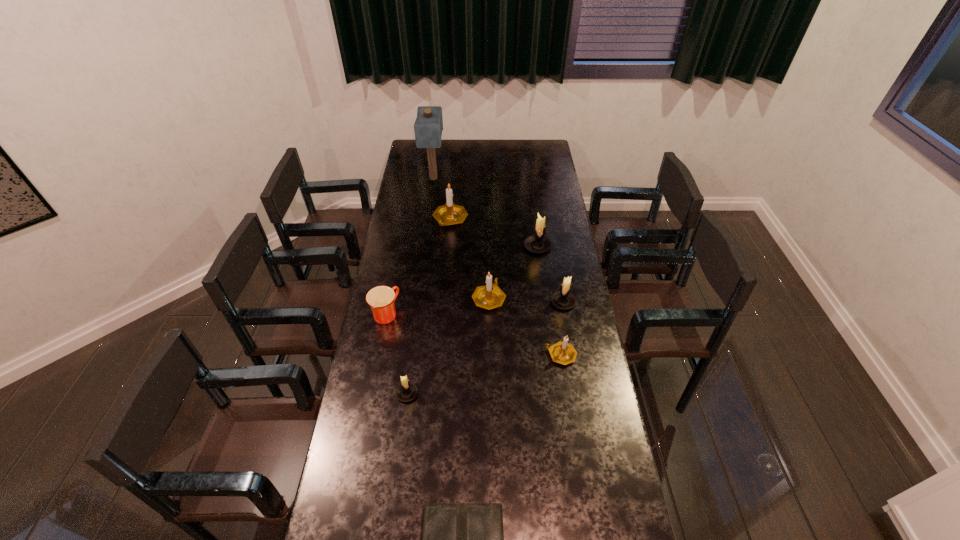
Identify the location of empty location between the second farthest gold candle holder and the brown mallet. (461, 238).

Find the location of a particular element. free space between the nearest gold candle holder and the smallest white candle holder is located at coordinates [484, 374].

Image resolution: width=960 pixels, height=540 pixels. What are the coordinates of `vacant space that's between the farthest object and the leftmost object` in the screenshot? It's located at (410, 246).

I want to click on empty space between the farthest gold candle holder and the second biggest white candle holder, so click(507, 261).

The width and height of the screenshot is (960, 540). What are the coordinates of `vacant area between the second farthest white candle holder and the second biggest gold candle holder` in the screenshot? It's located at (526, 300).

I want to click on free spot between the second farthest gold candle holder and the leftmost object, so click(438, 306).

The image size is (960, 540). Find the location of `unoccupied position between the second gold candle holder from right to left and the cup`. unoccupied position between the second gold candle holder from right to left and the cup is located at coordinates (438, 306).

Find the location of `object identified as the closest to the greenish book`. object identified as the closest to the greenish book is located at coordinates (407, 391).

At what (x,y) coordinates should I click in order to perform the action: click on the eighth closest object to the second nearest object. Please return your answer as a coordinate pair (x, y). Looking at the image, I should click on (428, 126).

The width and height of the screenshot is (960, 540). I want to click on the fifth closest candle holder relative to the greenish book, so click(538, 243).